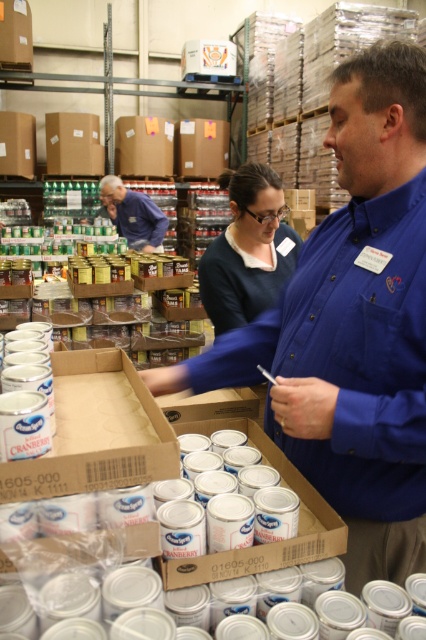
From the picture: Is blue button-up shirt at center further to camera compared to matte blue shirt at center?

No.

Which is above, blue button-up shirt at center or matte blue shirt at center?

matte blue shirt at center

Measure the distance between blue button-up shirt at center and camera.

blue button-up shirt at center is 35.47 inches away from camera.

Locate an element on the screen. The width and height of the screenshot is (426, 640). blue button-up shirt at center is located at coordinates (351, 324).

Between dark blue sweater at center and matte blue shirt at center, which one is positioned lower?

Positioned lower is dark blue sweater at center.

What do you see at coordinates (247, 250) in the screenshot? I see `dark blue sweater at center` at bounding box center [247, 250].

Between point (253, 179) and point (143, 195), which one is positioned behind?

Point (143, 195)

Image resolution: width=426 pixels, height=640 pixels. Find the location of `dark blue sweater at center`. dark blue sweater at center is located at coordinates (247, 250).

Between blue button-up shirt at center and dark blue sweater at center, which one appears on the right side from the viewer's perspective?

From the viewer's perspective, dark blue sweater at center appears more on the right side.

Is blue button-up shirt at center to the right of dark blue sweater at center from the viewer's perspective?

No, blue button-up shirt at center is not to the right of dark blue sweater at center.

At what (x,y) coordinates should I click in order to perform the action: click on blue button-up shirt at center. Please return your answer as a coordinate pair (x, y). Looking at the image, I should click on (351, 324).

Locate an element on the screen. The height and width of the screenshot is (640, 426). blue button-up shirt at center is located at coordinates pyautogui.click(x=351, y=324).